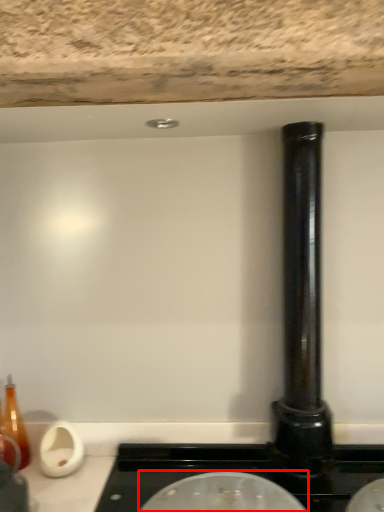
Question: From the image's perspective, where is appliance (annotated by the red box) located in relation to pillar in the image?

Choices:
 (A) below
 (B) above

Answer: (A)